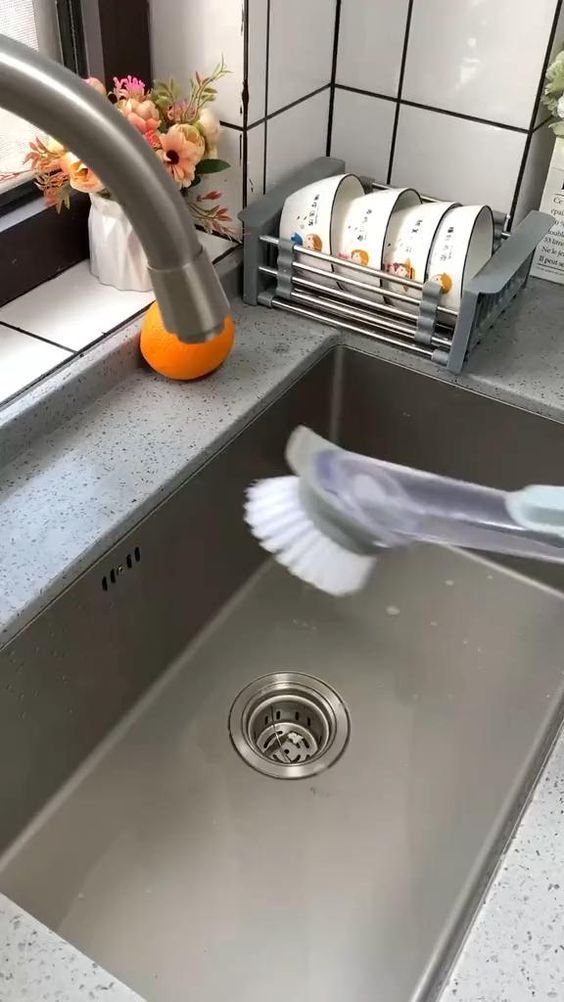
This screenshot has width=564, height=1002. Identify the location of vase. (121, 253).